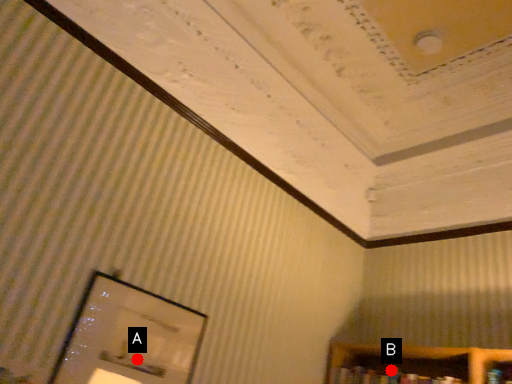
Question: Two points are circled on the image, labeled by A and B beside each circle. Among these points, which one is farthest from the camera?

Choices:
 (A) A is further
 (B) B is further

Answer: (B)